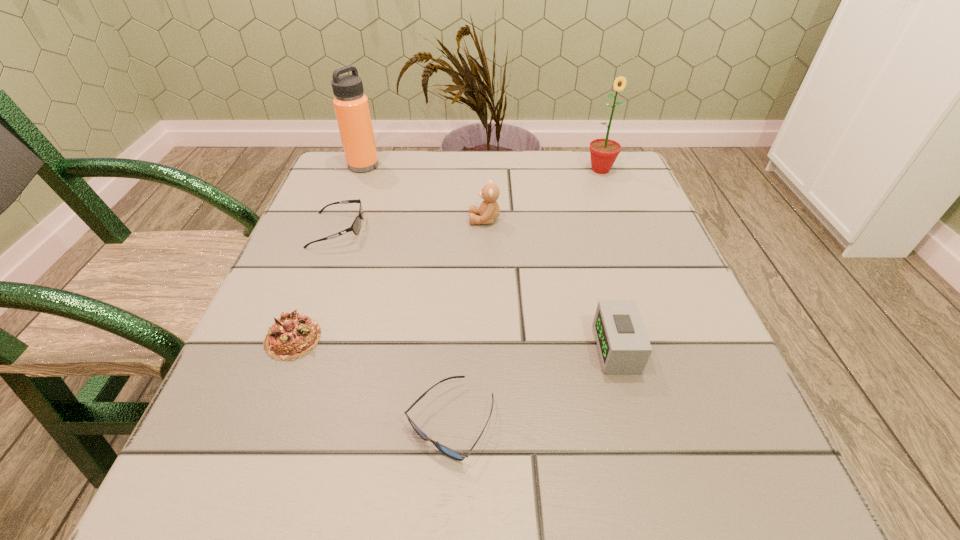
This screenshot has height=540, width=960. What are the coordinates of `thermos bottle present at the far edge` in the screenshot? It's located at (351, 106).

Identify the location of sunflower that is at the far edge. This screenshot has width=960, height=540. (603, 152).

In order to click on object located at the near edge in this screenshot , I will do `click(456, 455)`.

Identify the location of thermos bottle that is at the left edge. This screenshot has width=960, height=540. click(x=351, y=106).

At what (x,y) coordinates should I click in order to perform the action: click on sunglasses at the left edge. Please return your answer as a coordinate pair (x, y). Looking at the image, I should click on (356, 225).

Locate an element on the screen. This screenshot has height=540, width=960. chocolate cake at the left edge is located at coordinates (294, 334).

Where is `sunflower at the right edge`? This screenshot has width=960, height=540. sunflower at the right edge is located at coordinates (603, 152).

Find the location of a particular element. alarm clock present at the right edge is located at coordinates (624, 348).

At what (x,y) coordinates should I click in order to perform the action: click on object that is at the far left corner. Please return your answer as a coordinate pair (x, y). Looking at the image, I should click on (351, 106).

This screenshot has width=960, height=540. What are the coordinates of `object situated at the far right corner` in the screenshot? It's located at (603, 152).